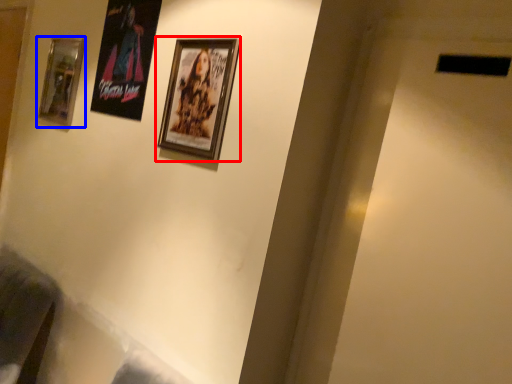
Question: Among these objects, which one is farthest to the camera, picture frame (highlighted by a red box) or picture frame (highlighted by a blue box)?

Choices:
 (A) picture frame
 (B) picture frame

Answer: (B)